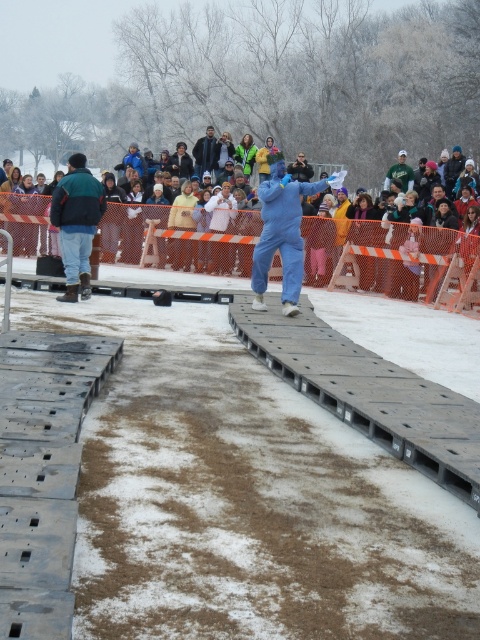
Question: Can you confirm if multicolored fabric crowd at upper center is bigger than blue matte jumpsuit at center?

Choices:
 (A) yes
 (B) no

Answer: (A)

Question: Is multicolored fabric crowd at upper center to the right of jeans at left from the viewer's perspective?

Choices:
 (A) no
 (B) yes

Answer: (B)

Question: Which of the following is the farthest from the observer?

Choices:
 (A) (266, 276)
 (B) (72, 179)

Answer: (A)

Question: Estimate the real-world distances between objects in this image. Which object is closer to the jeans at left?

Choices:
 (A) blue matte jumpsuit at center
 (B) multicolored fabric crowd at upper center

Answer: (A)

Question: Is multicolored fabric crowd at upper center to the left of jeans at left from the viewer's perspective?

Choices:
 (A) no
 (B) yes

Answer: (A)

Question: Estimate the real-world distances between objects in this image. Which object is farther from the multicolored fabric crowd at upper center?

Choices:
 (A) blue matte jumpsuit at center
 (B) jeans at left

Answer: (B)